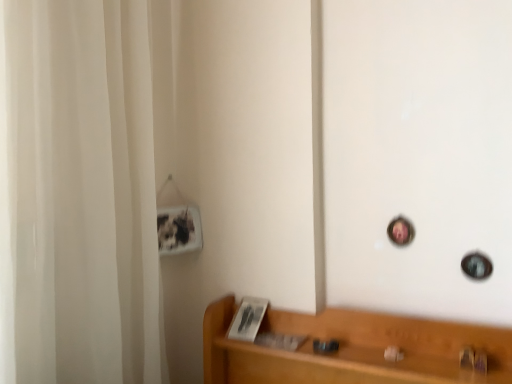
Find the location of a particular element. The image size is (512, 384). white fabric shower curtain at left is located at coordinates (78, 194).

The height and width of the screenshot is (384, 512). What do you see at coordinates (473, 359) in the screenshot?
I see `metallic gold door handle at lower right` at bounding box center [473, 359].

Locate an element on the screen. light brown wood shelf at lower right is located at coordinates (351, 349).

Is light brown wood shelf at lower right located within metallic gold door handle at lower right?

No.

Is there a large distance between metallic gold door handle at lower right and light brown wood shelf at lower right?

That's not correct — metallic gold door handle at lower right is a little close to light brown wood shelf at lower right.

Consider the image. From a real-world perspective, which object rests below the other?

light brown wood shelf at lower right is physically lower.

Is light brown wood shelf at lower right beside metallic gold door handle at lower right?

No, light brown wood shelf at lower right is not beside metallic gold door handle at lower right.

The height and width of the screenshot is (384, 512). Identify the location of door handle on the right of light brown wood shelf at lower right. (473, 359).

Between light brown wood shelf at lower right and metallic gold door handle at lower right, which one appears on the left side from the viewer's perspective?

light brown wood shelf at lower right is more to the left.

Considering the relative sizes of light brown wood shelf at lower right and metallic gold door handle at lower right in the image provided, is light brown wood shelf at lower right thinner than metallic gold door handle at lower right?

Incorrect, the width of light brown wood shelf at lower right is not less than that of metallic gold door handle at lower right.

Does white fabric shower curtain at left have a greater width compared to light brown wood shelf at lower right?

Correct, the width of white fabric shower curtain at left exceeds that of light brown wood shelf at lower right.

Considering the positions of point (147, 16) and point (300, 317), is point (147, 16) closer or farther from the camera than point (300, 317)?

Point (147, 16) appears to be closer to the viewer than point (300, 317).

Is white fabric shower curtain at left looking in the opposite direction of light brown wood shelf at lower right?

white fabric shower curtain at left is not turned away from light brown wood shelf at lower right.

Considering the sizes of objects white fabric shower curtain at left and light brown wood shelf at lower right in the image provided, who is shorter, white fabric shower curtain at left or light brown wood shelf at lower right?

light brown wood shelf at lower right.

Is light brown wood shelf at lower right directly adjacent to white fabric shower curtain at left?

No.

Which is more to the left, light brown wood shelf at lower right or white fabric shower curtain at left?

Positioned to the left is white fabric shower curtain at left.

Find the location of a particular element. The width and height of the screenshot is (512, 384). furniture below the white fabric shower curtain at left (from the image's perspective) is located at coordinates (351, 349).

Is white fabric shower curtain at left to the left of metallic gold door handle at lower right from the viewer's perspective?

Yes.

Does white fabric shower curtain at left have a lesser height compared to metallic gold door handle at lower right?

No, white fabric shower curtain at left is not shorter than metallic gold door handle at lower right.

Is white fabric shower curtain at left further to the viewer compared to metallic gold door handle at lower right?

No, white fabric shower curtain at left is closer to the camera.

Can you tell me how much white fabric shower curtain at left and metallic gold door handle at lower right differ in facing direction?

110 degrees.

Considering the sizes of metallic gold door handle at lower right and white fabric shower curtain at left in the image, is metallic gold door handle at lower right bigger or smaller than white fabric shower curtain at left?

Clearly, metallic gold door handle at lower right is smaller in size than white fabric shower curtain at left.

Is metallic gold door handle at lower right positioned beyond the bounds of white fabric shower curtain at left?

That's correct, metallic gold door handle at lower right is outside of white fabric shower curtain at left.

Locate an element on the screen. The image size is (512, 384). shower curtain in front of the metallic gold door handle at lower right is located at coordinates (78, 194).

Which object is positioned more to the left, metallic gold door handle at lower right or white fabric shower curtain at left?

white fabric shower curtain at left is more to the left.

The height and width of the screenshot is (384, 512). In order to click on furniture in front of the metallic gold door handle at lower right in this screenshot , I will do (351, 349).

I want to click on furniture located on the left of metallic gold door handle at lower right, so click(351, 349).

Based on their spatial positions, is light brown wood shelf at lower right or white fabric shower curtain at left further from metallic gold door handle at lower right?

white fabric shower curtain at left.

In the scene shown: Estimate the real-world distances between objects in this image. Which object is further from light brown wood shelf at lower right, metallic gold door handle at lower right or white fabric shower curtain at left?

Among the two, white fabric shower curtain at left is located further to light brown wood shelf at lower right.

When comparing their distances from light brown wood shelf at lower right, does white fabric shower curtain at left or metallic gold door handle at lower right seem closer?

metallic gold door handle at lower right lies closer to light brown wood shelf at lower right than the other object.

Considering their positions, is white fabric shower curtain at left positioned closer to metallic gold door handle at lower right than light brown wood shelf at lower right?

light brown wood shelf at lower right lies closer to metallic gold door handle at lower right than the other object.

Which object lies nearer to the anchor point white fabric shower curtain at left, light brown wood shelf at lower right or metallic gold door handle at lower right?

light brown wood shelf at lower right is positioned closer to the anchor white fabric shower curtain at left.

From the image, which object appears to be nearer to white fabric shower curtain at left, metallic gold door handle at lower right or light brown wood shelf at lower right?

light brown wood shelf at lower right is closer to white fabric shower curtain at left.

The image size is (512, 384). Identify the location of furniture between white fabric shower curtain at left and metallic gold door handle at lower right. (351, 349).